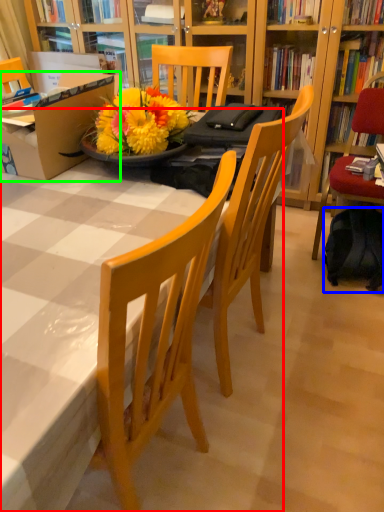
Question: Which object is positioned closest to desk (highlighted by a red box)? Select from backpack (highlighted by a blue box) and box (highlighted by a green box).

Choices:
 (A) backpack
 (B) box

Answer: (B)